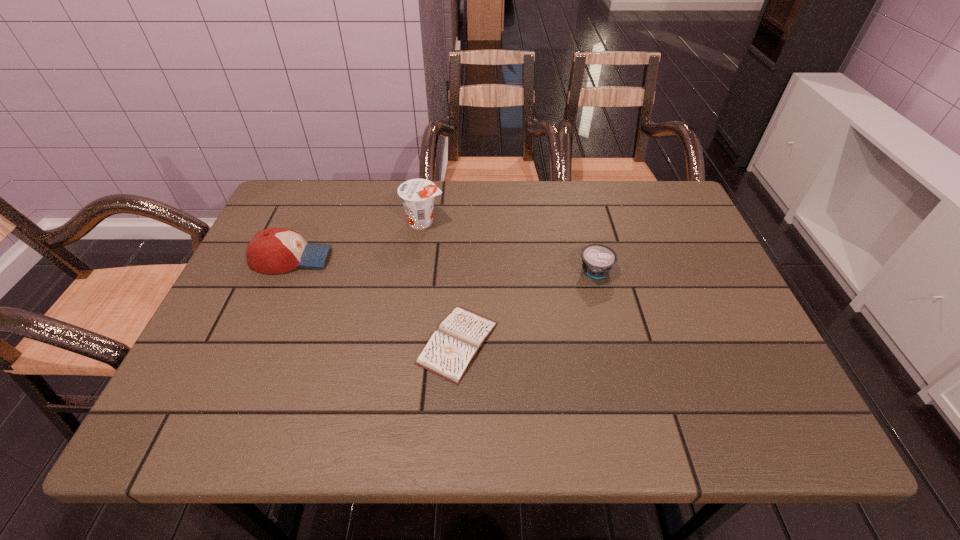
Where is `free space that satisfies the following two spatial constraints: 1. on the front side of the farthest object; 2. on the front-facing side of the leftmost object`? The image size is (960, 540). free space that satisfies the following two spatial constraints: 1. on the front side of the farthest object; 2. on the front-facing side of the leftmost object is located at coordinates (419, 259).

In order to click on free spot that satisfies the following two spatial constraints: 1. on the back side of the rightmost object; 2. on the front-facing side of the leftmost object in this screenshot , I will do [592, 259].

Image resolution: width=960 pixels, height=540 pixels. Identify the location of free space that satisfies the following two spatial constraints: 1. on the front-facing side of the third tallest object; 2. on the right side of the third shortest object. (286, 272).